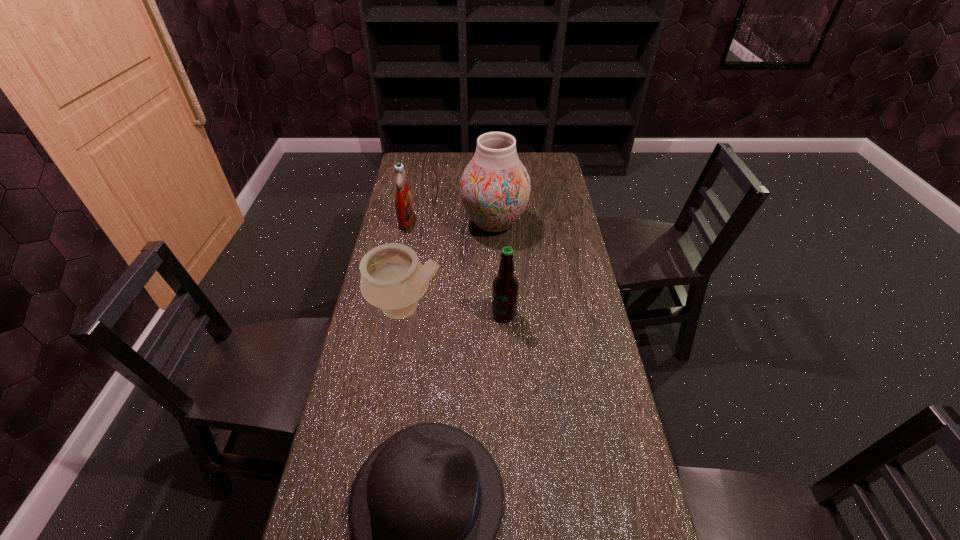
Find the location of `vacant space that satisfies the following two spatial constraints: 1. on the front surface of the detergent; 2. on the back side of the tallest object`. vacant space that satisfies the following two spatial constraints: 1. on the front surface of the detergent; 2. on the back side of the tallest object is located at coordinates (406, 223).

I want to click on blank space that satisfies the following two spatial constraints: 1. on the back side of the pottery; 2. on the left side of the vase, so click(x=420, y=223).

Where is `vacant area in the image that satisfies the following two spatial constraints: 1. on the front surface of the detergent; 2. on the back side of the tallest object`? This screenshot has height=540, width=960. vacant area in the image that satisfies the following two spatial constraints: 1. on the front surface of the detergent; 2. on the back side of the tallest object is located at coordinates (406, 223).